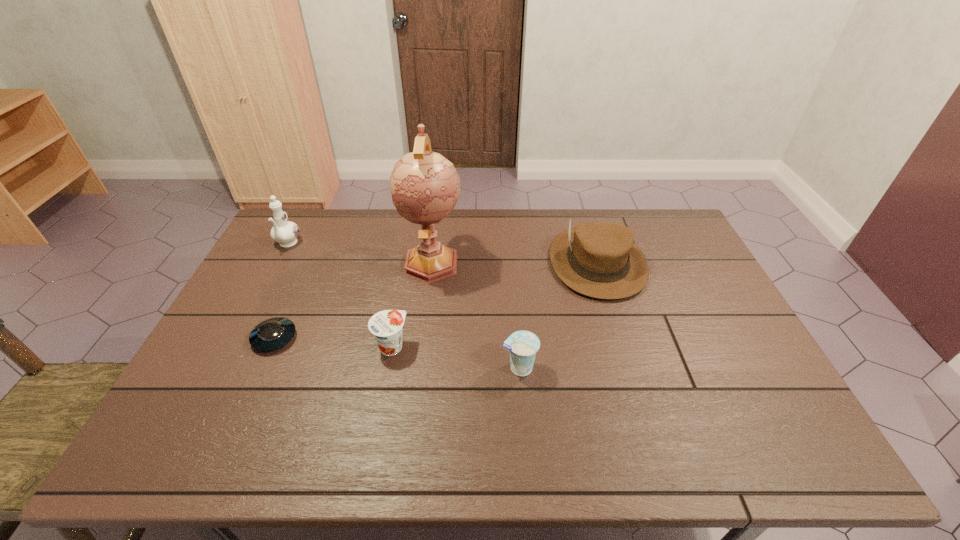
Locate an element on the screen. The height and width of the screenshot is (540, 960). free space between the rightmost object and the left yogurt is located at coordinates pos(494,305).

Where is `free spot between the chinaware and the left yogurt`? Image resolution: width=960 pixels, height=540 pixels. free spot between the chinaware and the left yogurt is located at coordinates (340, 296).

Identify the location of empty space that is in between the fifth object from left to right and the left yogurt. (455, 357).

Locate an element on the screen. The image size is (960, 540). object that can be found as the fourth closest to the tallest object is located at coordinates (600, 260).

Identify the location of object that ranks as the fourth closest to the right yogurt. This screenshot has width=960, height=540. (x=274, y=333).

Locate an element on the screen. The width and height of the screenshot is (960, 540). free space that satisfies the following two spatial constraints: 1. at the spout of the chinaware; 2. on the right side of the fifth object from left to right is located at coordinates (223, 368).

Where is `free location that satisfies the following two spatial constraints: 1. at the spout of the fifth object from left to right; 2. on the right side of the chinaware`? free location that satisfies the following two spatial constraints: 1. at the spout of the fifth object from left to right; 2. on the right side of the chinaware is located at coordinates (223, 368).